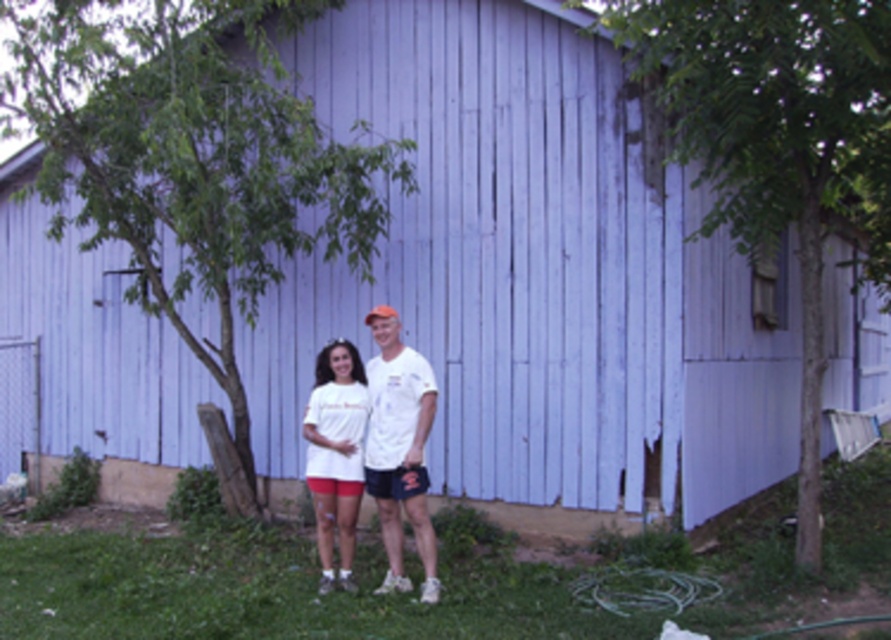
Between white cotton t-shirt at center and white matte t-shirt at center, which one is positioned lower?

Positioned lower is white matte t-shirt at center.

Locate an element on the screen. This screenshot has height=640, width=891. white cotton t-shirt at center is located at coordinates (399, 449).